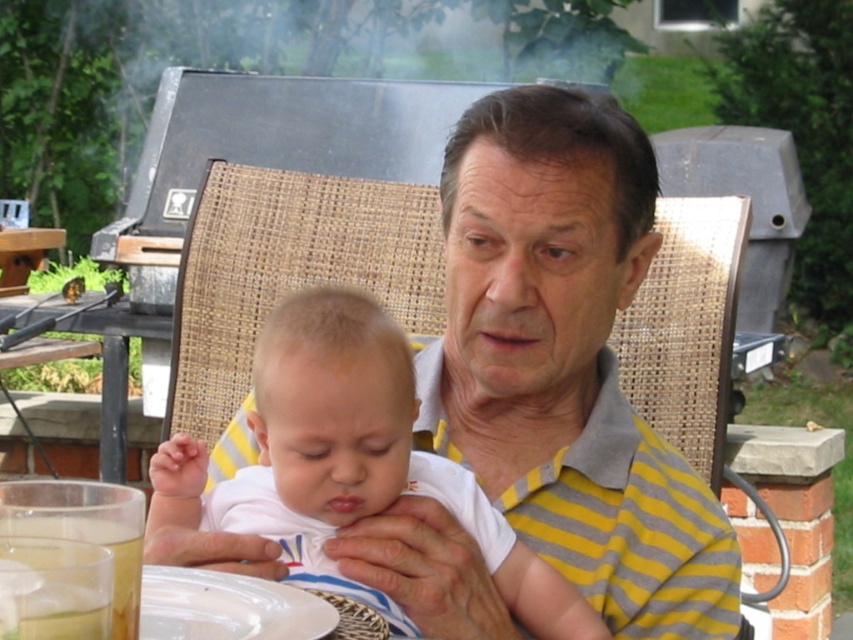
Question: Does white cotton baby at center appear over white matte plate at lower center?

Choices:
 (A) yes
 (B) no

Answer: (A)

Question: Among these points, which one is farthest from the camera?

Choices:
 (A) (579, 618)
 (B) (55, 536)
 (C) (598, 550)

Answer: (C)

Question: Can you confirm if yellow striped polo shirt at center is smaller than white matte plate at lower center?

Choices:
 (A) no
 (B) yes

Answer: (A)

Question: Which point is farther to the camera?

Choices:
 (A) translucent plastic cup at lower left
 (B) white cotton baby at center
 (C) white matte plate at lower center
 (D) yellow striped polo shirt at center

Answer: (D)

Question: Which point is closer to the camera?

Choices:
 (A) (44, 532)
 (B) (666, 552)
 (C) (288, 614)
 (D) (271, 397)

Answer: (A)

Question: Is yellow striped polo shirt at center wider than translucent plastic cup at lower left?

Choices:
 (A) no
 (B) yes

Answer: (B)